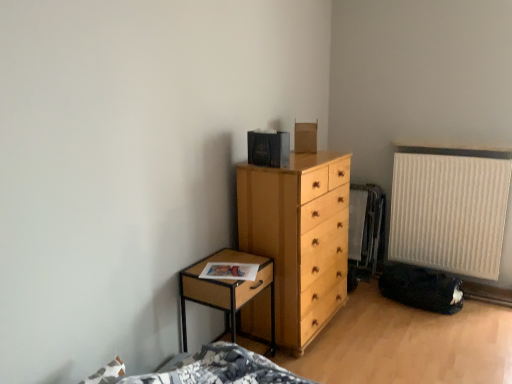
Question: In terms of width, does beige ribbed radiator at right look wider or thinner when compared to light wood chest of drawers at center?

Choices:
 (A) wide
 (B) thin

Answer: (B)

Question: From the image's perspective, is beige ribbed radiator at right positioned above or below light wood chest of drawers at center?

Choices:
 (A) below
 (B) above

Answer: (B)

Question: Which is nearer to the woodennightstand at left?

Choices:
 (A) beige ribbed radiator at right
 (B) light wood chest of drawers at center

Answer: (B)

Question: Estimate the real-world distances between objects in this image. Which object is closer to the beige ribbed radiator at right?

Choices:
 (A) woodennightstand at left
 (B) light wood chest of drawers at center

Answer: (B)